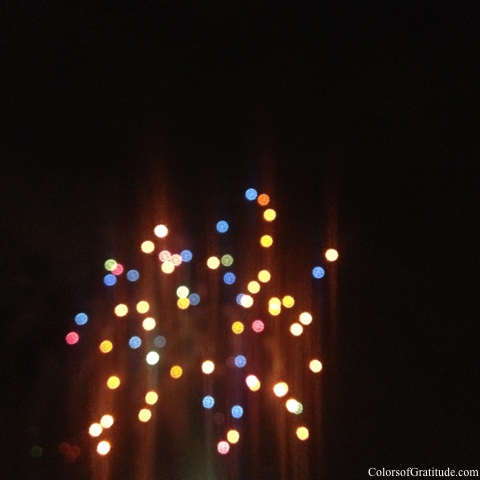
Image resolution: width=480 pixels, height=480 pixels. Identify the location of left most blue light. pyautogui.click(x=79, y=318).